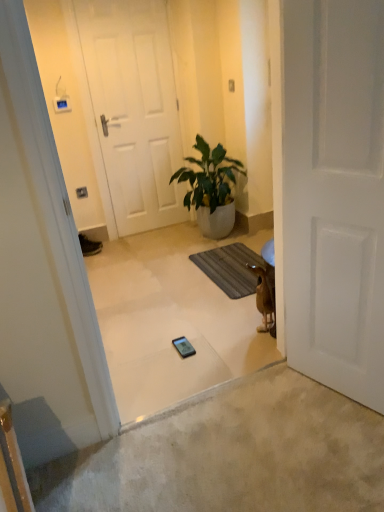
Locate an element on the screen. This screenshot has width=384, height=512. free space to the left of brown furry dog at lower right is located at coordinates (232, 334).